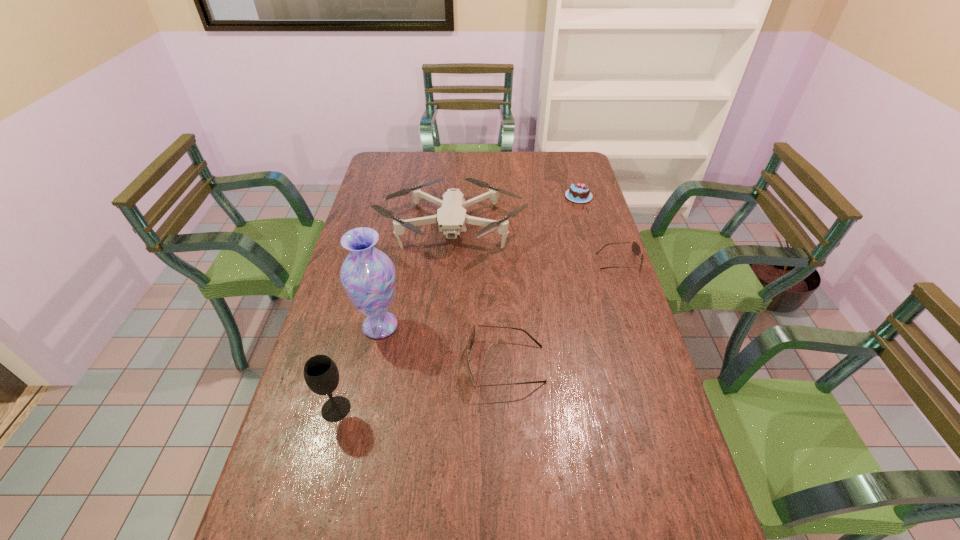
The image size is (960, 540). I want to click on vacant space situated on the front-facing side of the third shortest object, so click(x=427, y=364).

In order to click on free point located 0.300m with a camera at the front of the fourth shortest object in this screenshot , I will do `click(444, 336)`.

Identify the location of free location located on the left of the fifth tallest object. The image size is (960, 540). (506, 197).

Find the location of a particular element. The width and height of the screenshot is (960, 540). free location located on the back of the vase is located at coordinates (393, 266).

Locate an element on the screen. This screenshot has height=540, width=960. vacant area situated 0.130m on the front of the second tallest object is located at coordinates (319, 477).

This screenshot has height=540, width=960. What are the coordinates of `drone that is at the left edge` in the screenshot? It's located at (451, 217).

Where is `vase that is at the left edge`? The height and width of the screenshot is (540, 960). vase that is at the left edge is located at coordinates (368, 276).

Where is `wineglass located at the left edge`? wineglass located at the left edge is located at coordinates (321, 374).

Where is `sunglasses that is at the right edge`? The width and height of the screenshot is (960, 540). sunglasses that is at the right edge is located at coordinates (636, 249).

Locate an element on the screen. chocolate cake situated at the right edge is located at coordinates click(x=578, y=192).